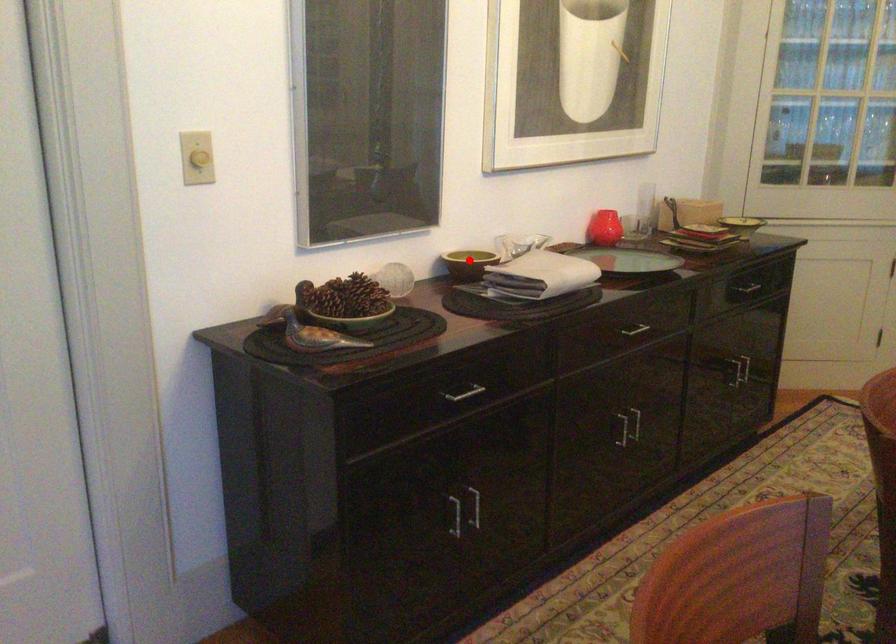
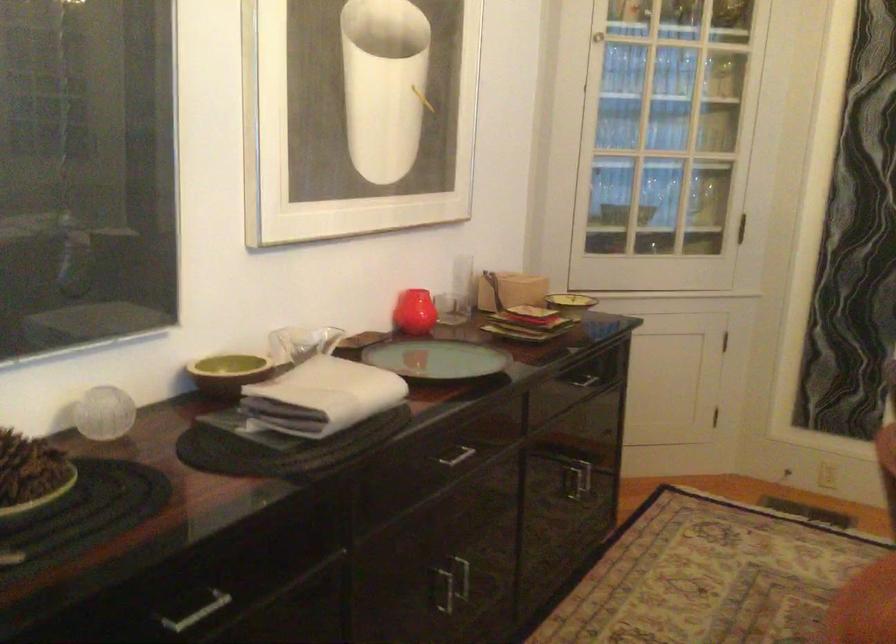
Question: I am providing you with two images of the same scene from different viewpoints. In image1, a red point is highlighted. Considering the same 3D point in image2, which of the following is correct?

Choices:
 (A) It is closer
 (B) It is farther

Answer: (A)